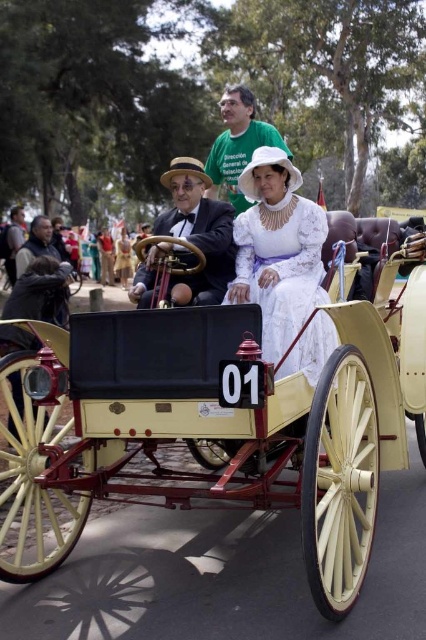
You are a photographer positioned at the back of the vintage car. You need to capture a photo where both the white cotton dress at center and the dark brown leather jacket at left are clearly visible. Given their sizes, which object might appear larger in the photo?

The white cotton dress at center is much taller than the dark brown leather jacket at left, so it will appear larger in the photo.

You are a photographer at the vintage car event. You need to capture a photo of both the white lace dress at center and the white cotton dress at center. Which dress is positioned lower on the car?

The white lace dress at center is located below the white cotton dress at center, so the white lace dress at center is positioned lower on the car.

You are organizing a historical parade and need to decide which vehicle to place in the front row. The light cream polished wood horse cart at center and the matte black coach at center are both candidates. Based on their sizes, which one should you choose for the front to ensure visibility for the audience?

The light cream polished wood horse cart at center is bigger than the matte black coach at center, so it should be placed in the front row to ensure better visibility for the audience.